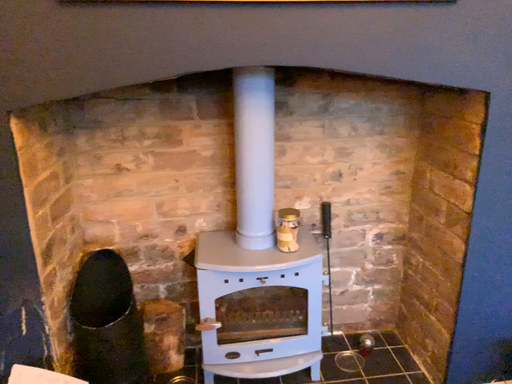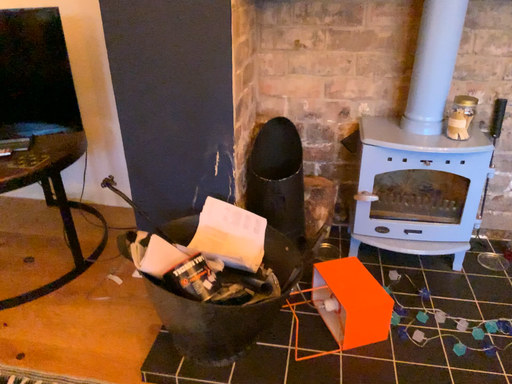
Question: Which way did the camera rotate in the video?

Choices:
 (A) rotated left
 (B) rotated right

Answer: (A)